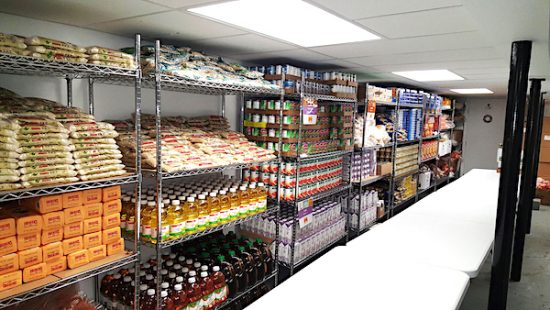
Locate an element on the screen. door is located at coordinates (487, 134).